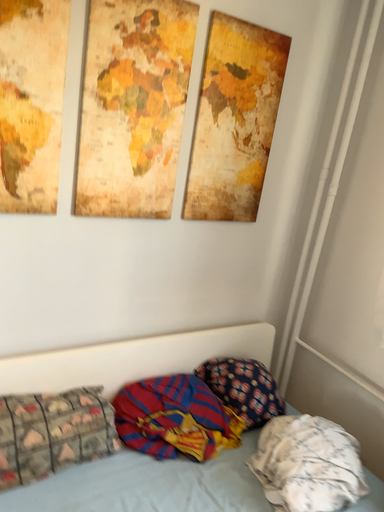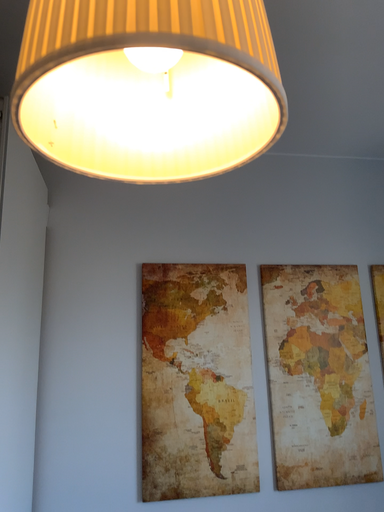
Question: Which way did the camera rotate in the video?

Choices:
 (A) rotated left
 (B) rotated right

Answer: (A)